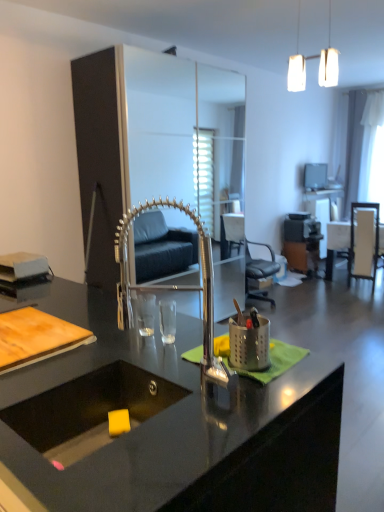
The height and width of the screenshot is (512, 384). I want to click on free spot behind polished chrome faucet at center, so click(176, 358).